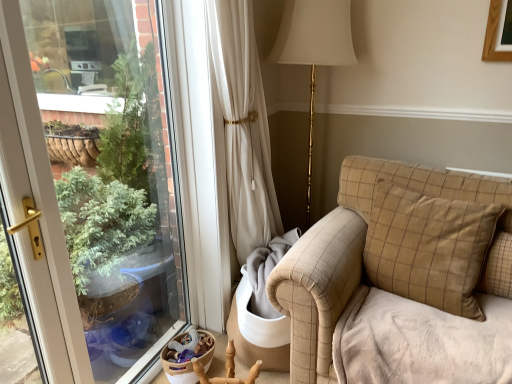
Question: Is the depth of beige checkered pillow at right greater than that of beige checkered couch at right?

Choices:
 (A) no
 (B) yes

Answer: (B)

Question: From a real-world perspective, is beige checkered pillow at right on beige checkered couch at right?

Choices:
 (A) no
 (B) yes

Answer: (A)

Question: From a real-world perspective, is beige checkered pillow at right beneath beige checkered couch at right?

Choices:
 (A) no
 (B) yes

Answer: (B)

Question: Is beige checkered pillow at right in contact with beige checkered couch at right?

Choices:
 (A) no
 (B) yes

Answer: (A)

Question: Considering the relative sizes of beige checkered pillow at right and beige checkered couch at right in the image provided, is beige checkered pillow at right thinner than beige checkered couch at right?

Choices:
 (A) no
 (B) yes

Answer: (B)

Question: Can you confirm if beige checkered pillow at right is shorter than beige checkered couch at right?

Choices:
 (A) no
 (B) yes

Answer: (B)

Question: From a real-world perspective, is wooden armchair at lower center on top of beige checkered pillow at right?

Choices:
 (A) yes
 (B) no

Answer: (B)

Question: Is wooden armchair at lower center aimed at beige checkered pillow at right?

Choices:
 (A) yes
 (B) no

Answer: (B)

Question: From a real-world perspective, is wooden armchair at lower center beneath beige checkered pillow at right?

Choices:
 (A) no
 (B) yes

Answer: (B)

Question: From the image's perspective, is wooden armchair at lower center beneath beige checkered pillow at right?

Choices:
 (A) yes
 (B) no

Answer: (A)

Question: From the image's perspective, does wooden armchair at lower center appear higher than beige checkered pillow at right?

Choices:
 (A) no
 (B) yes

Answer: (A)

Question: Is wooden armchair at lower center to the left of beige checkered pillow at right from the viewer's perspective?

Choices:
 (A) yes
 (B) no

Answer: (A)

Question: From a real-world perspective, is wooden armchair at lower center on top of beige checkered couch at right?

Choices:
 (A) no
 (B) yes

Answer: (A)